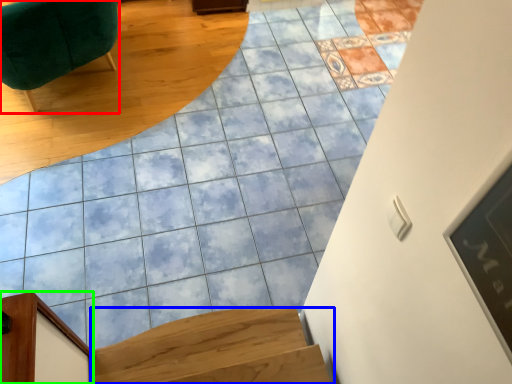
Question: Based on their relative distances, which object is farther from furniture (highlighted by a red box)? Choose from stairs (highlighted by a blue box) and furniture (highlighted by a green box).

Choices:
 (A) stairs
 (B) furniture

Answer: (A)